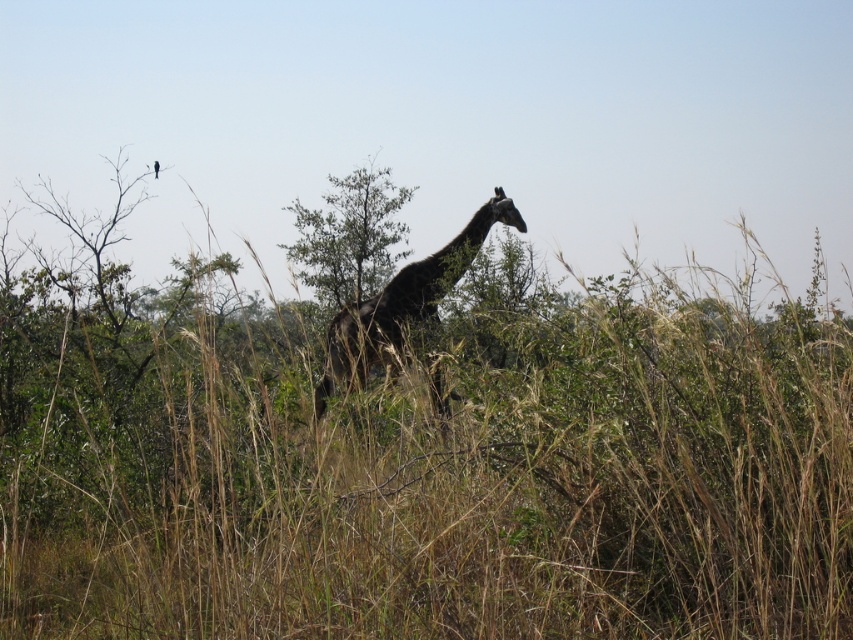
Question: Among these objects, which one is farthest from the camera?

Choices:
 (A) dark brown textured giraffe at center
 (B) green leafy tree at center

Answer: (B)

Question: Can you confirm if dark brown textured giraffe at center is bigger than green leafy tree at center?

Choices:
 (A) yes
 (B) no

Answer: (A)

Question: Which point is closer to the camera?

Choices:
 (A) green leafy tree at center
 (B) dark brown textured giraffe at center

Answer: (B)

Question: Can you confirm if dark brown textured giraffe at center is wider than green leafy tree at center?

Choices:
 (A) yes
 (B) no

Answer: (A)

Question: Does dark brown textured giraffe at center lie behind green leafy tree at center?

Choices:
 (A) no
 (B) yes

Answer: (A)